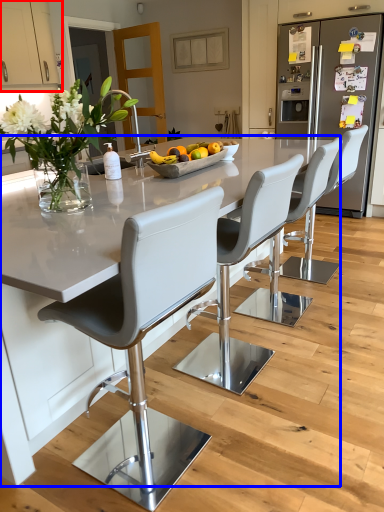
Question: Which object is closer to the camera taking this photo, cabinetry (highlighted by a red box) or kitchen & dining room table (highlighted by a blue box)?

Choices:
 (A) cabinetry
 (B) kitchen & dining room table

Answer: (B)